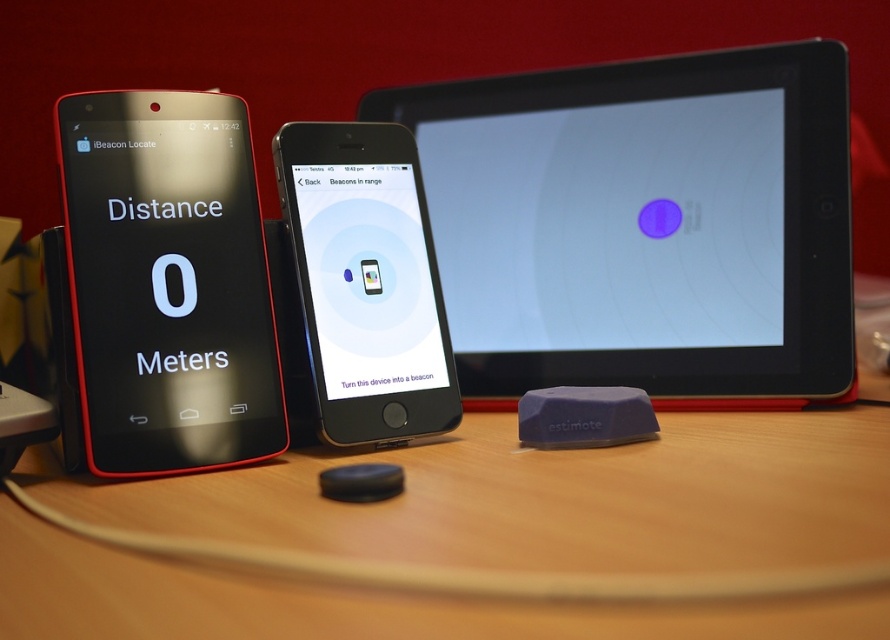
You are standing in front of the three electronic devices on the wooden surface. You notice two points marked on the image. The first point is at coordinates point [204,148] and the second is at point [330,195]. Which point is closer to you?

Point [204,148] is in front of point [330,195], so the first point is closer to you.

You are a delivery robot that needs to pick up the black glossy ipod touch at center. There is a black glossy phone at left in the way. Can you move around it to reach the ipod?

The black glossy phone at left is closer to the viewer than the black glossy ipod touch at center, so the robot can move around it to reach the ipod touch at center.

You are trying to place a small book on the wooden table at center so it can be seen over the black glossy ipod touch at center. Is the table tall enough for this?

The wooden table at center has a lesser height compared to black glossy ipod touch at center, so placing the book on it would not make it visible over the ipod touch since the table is shorter than the device.